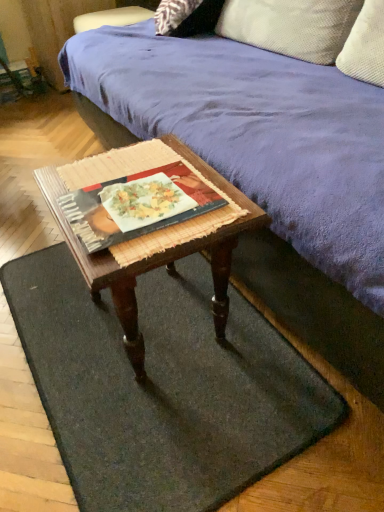
Question: Considering the positions of purple suede couch at upper center and matte black book at center in the image, is purple suede couch at upper center wider or thinner than matte black book at center?

Choices:
 (A) thin
 (B) wide

Answer: (B)

Question: Which is correct: purple suede couch at upper center is inside matte black book at center, or outside of it?

Choices:
 (A) outside
 (B) inside

Answer: (A)

Question: Estimate the real-world distances between objects in this image. Which object is farther from the textured beige pillow at upper right?

Choices:
 (A) green felt doormat at lower center
 (B) matte black book at center
 (C) purple suede couch at upper center
 (D) woven wood coffee table at center

Answer: (A)

Question: Estimate the real-world distances between objects in this image. Which object is farther from the woven wood coffee table at center?

Choices:
 (A) green felt doormat at lower center
 (B) textured beige pillow at upper right
 (C) matte black book at center
 (D) purple suede couch at upper center

Answer: (B)